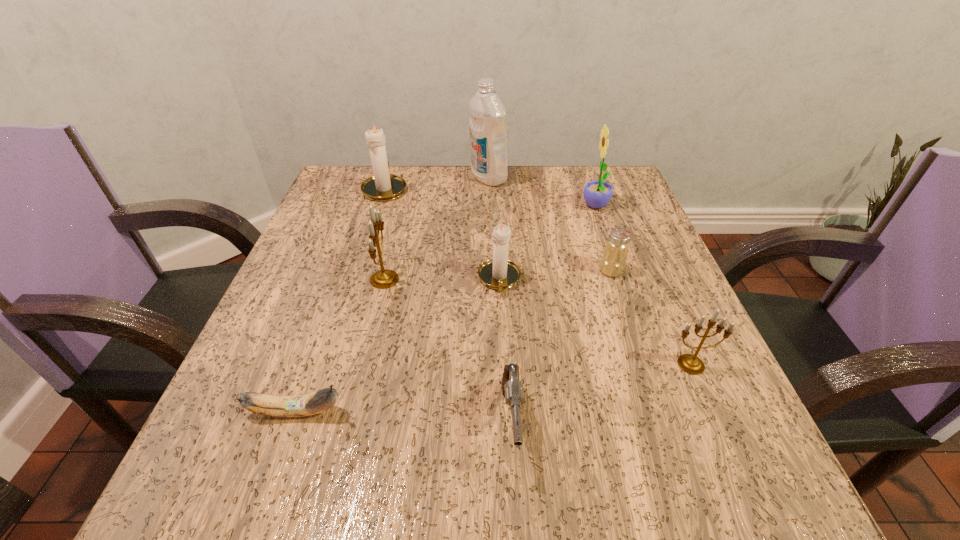
Identify the location of saltshaker that is at the right edge. This screenshot has height=540, width=960. (613, 261).

Locate an element on the screen. This screenshot has height=540, width=960. object that is positioned at the far left corner is located at coordinates (383, 186).

The width and height of the screenshot is (960, 540). I want to click on object that is at the far right corner, so click(x=597, y=193).

The width and height of the screenshot is (960, 540). Find the location of `free region at the far edge of the desktop`. free region at the far edge of the desktop is located at coordinates (511, 165).

In the image, there is a desktop. At what (x,y) coordinates should I click in order to perform the action: click on free region at the near edge. Please return your answer as a coordinate pair (x, y). Looking at the image, I should click on (594, 464).

This screenshot has height=540, width=960. Find the location of `vacant space at the left edge of the desktop`. vacant space at the left edge of the desktop is located at coordinates (x=367, y=226).

Find the location of a particular element. This screenshot has width=960, height=540. free space at the right edge is located at coordinates pos(635,336).

The image size is (960, 540). In the image, there is a desktop. Find the location of `vacant area at the far left corner`. vacant area at the far left corner is located at coordinates (390, 166).

You are a GUI agent. You are given a task and a screenshot of the screen. Output one action in this format:
    pyautogui.click(x=<x>, y=<y>)
    Task: Click on the vacant area at the far right corner
    This screenshot has height=540, width=960.
    Given the screenshot: What is the action you would take?
    pyautogui.click(x=619, y=171)

At what (x,y) coordinates should I click in order to perform the action: click on vacant space at the near right corner. Please return your answer as a coordinate pair (x, y). The image size is (960, 540). Looking at the image, I should click on (761, 477).